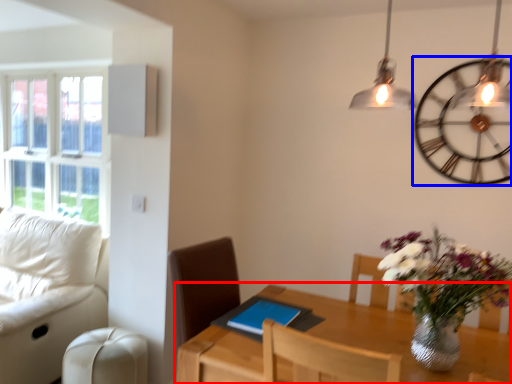
Question: Among these objects, which one is nearest to the camera, table (highlighted by a red box) or wall clock (highlighted by a blue box)?

Choices:
 (A) table
 (B) wall clock

Answer: (A)